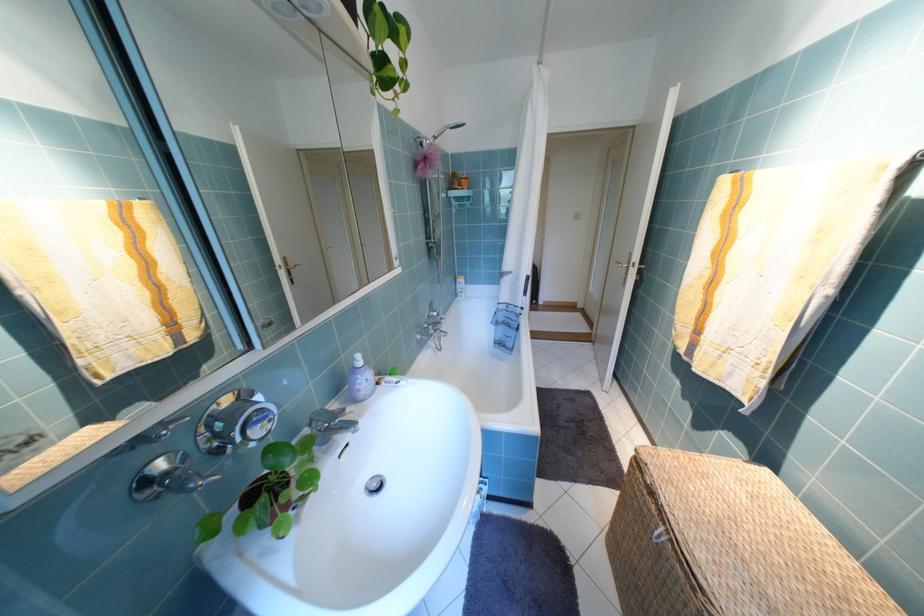
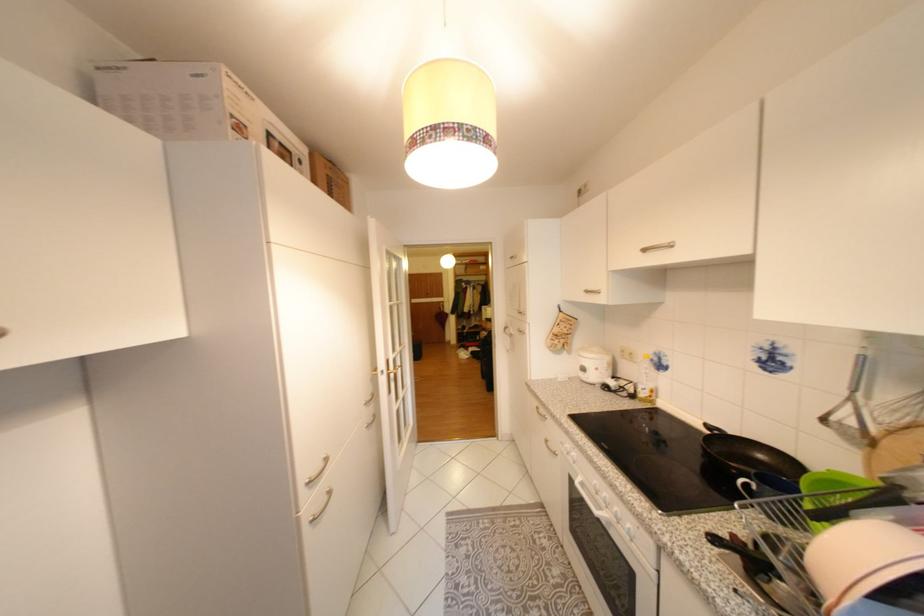
Question: Which direction would the cameraman need to move to produce the second image? Reply with the corresponding letter.

Choices:
 (A) Left
 (B) Right
 (C) Forward
 (D) Backward

Answer: (A)